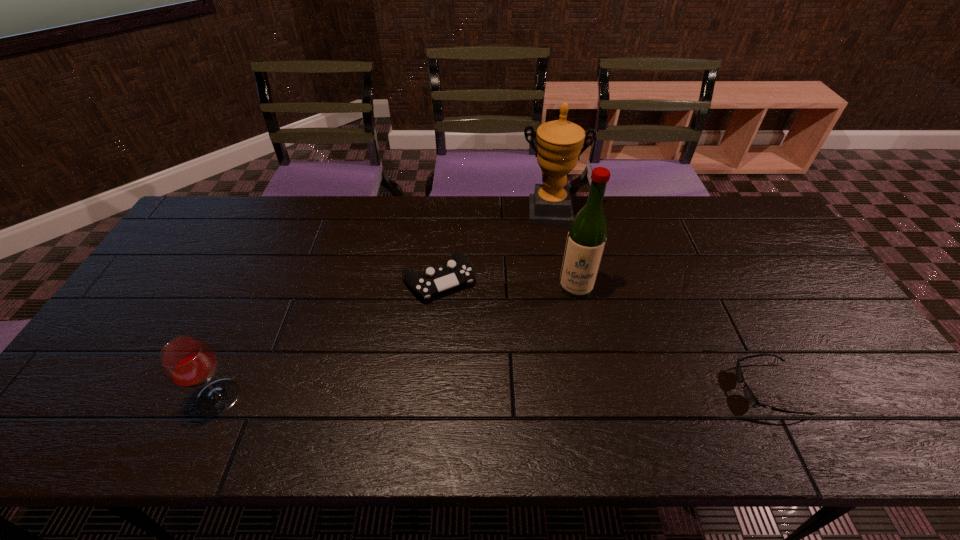
At what (x,y) coordinates should I click in order to perform the action: click on vacant space on the desktop that is between the third tallest object and the shortest object and is positioned on the surface of the control. Please return your answer as a coordinate pair (x, y). Looking at the image, I should click on click(507, 393).

Locate an element on the screen. Image resolution: width=960 pixels, height=540 pixels. free spot on the desktop that is between the leftmost object and the rightmost object and is positioned at the front of the award with handles is located at coordinates (558, 392).

This screenshot has width=960, height=540. What are the coordinates of `vacant space on the desktop that is between the third tallest object and the shortest object and is positioned on the label of the liquor` in the screenshot? It's located at (564, 392).